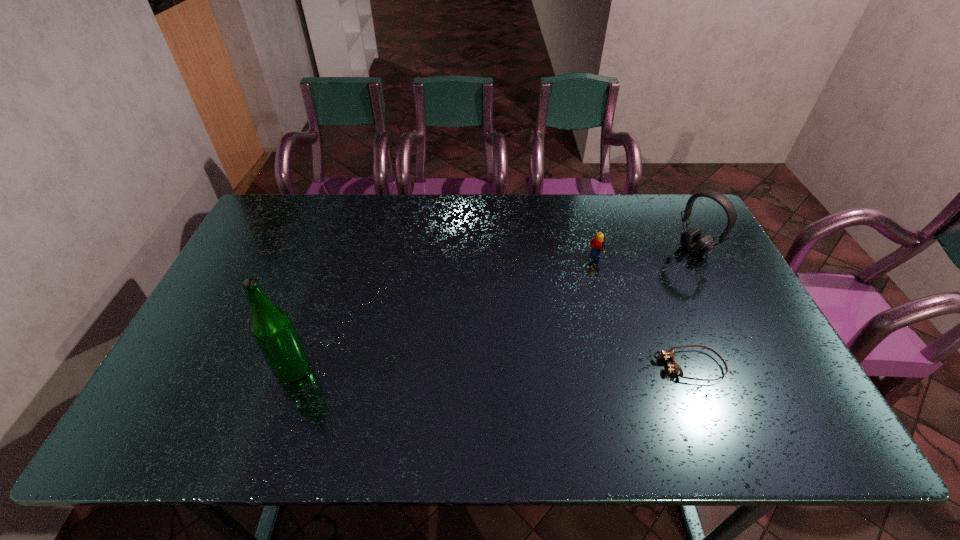
This screenshot has height=540, width=960. Find the location of `free space between the second object from right to left and the third object from right to left`. free space between the second object from right to left and the third object from right to left is located at coordinates (642, 313).

Locate which object is the second closest to the tallest object. Please provide its 2D coordinates. Your answer should be formatted as a tuple, i.e. [(x, y)], where the tuple contains the x and y coordinates of a point satisfying the conditions above.

[(673, 367)]

Find the location of a particular element. Image resolution: width=960 pixels, height=540 pixels. object that ranks as the third closest to the third object from left to right is located at coordinates (272, 329).

This screenshot has width=960, height=540. In order to click on vacant space that satisfies the following two spatial constraints: 1. on the back side of the third shortest object; 2. on the left side of the third object from right to left in this screenshot , I will do `click(592, 250)`.

The height and width of the screenshot is (540, 960). Identify the location of free location that satisfies the following two spatial constraints: 1. on the back side of the third tallest object; 2. on the right side of the second tallest object. (592, 250).

The height and width of the screenshot is (540, 960). Find the location of `vacant space that satisfies the following two spatial constraints: 1. on the front side of the Lego; 2. on the front lenses and sides of the goggles`. vacant space that satisfies the following two spatial constraints: 1. on the front side of the Lego; 2. on the front lenses and sides of the goggles is located at coordinates (624, 366).